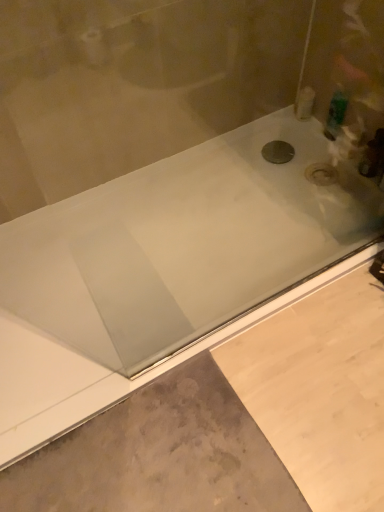
Find the location of `vacant area that is situated to the right of black metallic drain at center`. vacant area that is situated to the right of black metallic drain at center is located at coordinates (308, 154).